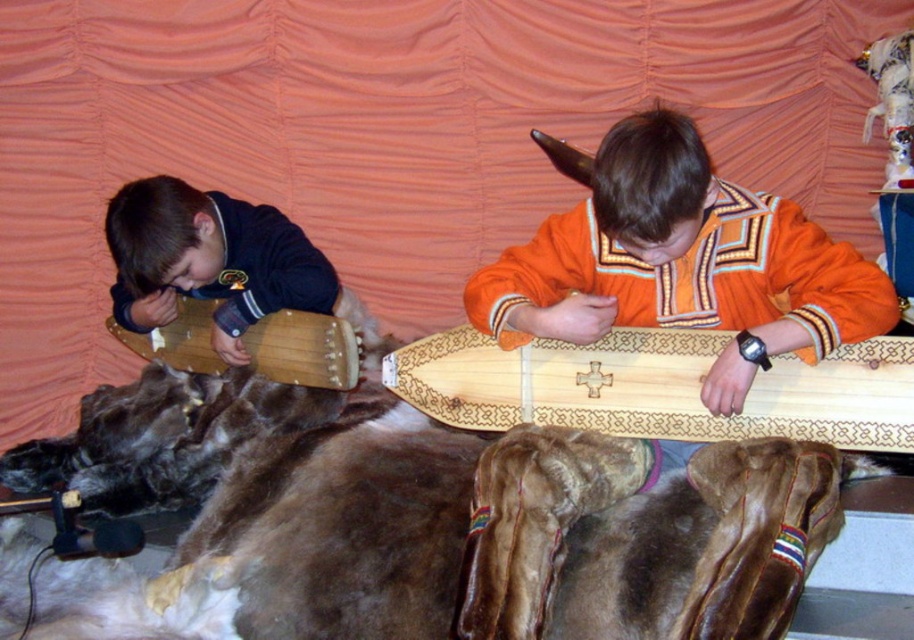
Based on the photo, is orange fabric shirt at center closer to the viewer compared to natural wood longboard at center?

That is True.

Where is `orange fabric shirt at center`? The height and width of the screenshot is (640, 914). orange fabric shirt at center is located at coordinates (683, 262).

Does matte black sweater at left have a lesser width compared to wooden drum at left?

Yes.

Can you confirm if matte black sweater at left is bigger than wooden drum at left?

Indeed, matte black sweater at left has a larger size compared to wooden drum at left.

This screenshot has height=640, width=914. What do you see at coordinates (209, 260) in the screenshot?
I see `matte black sweater at left` at bounding box center [209, 260].

The image size is (914, 640). Identify the location of matte black sweater at left. (209, 260).

Who is taller, orange fabric shirt at center or matte black sweater at left?

orange fabric shirt at center

Who is more forward, (x=729, y=212) or (x=133, y=205)?

Point (x=729, y=212)

Who is more distant from viewer, (784, 253) or (235, 259)?

Positioned behind is point (235, 259).

Locate an element on the screen. orange fabric shirt at center is located at coordinates (683, 262).